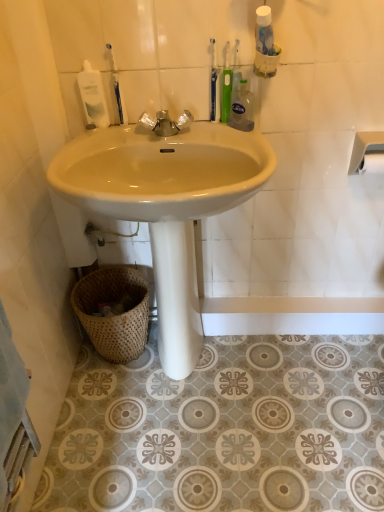
Where is `vacant area that lies between clear liquid soap at upper center and matte silver faucet at center`? The height and width of the screenshot is (512, 384). vacant area that lies between clear liquid soap at upper center and matte silver faucet at center is located at coordinates (210, 133).